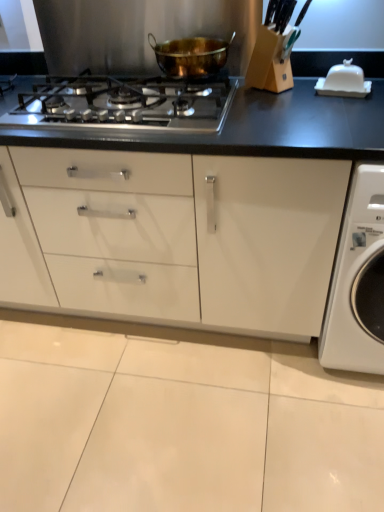
What do you see at coordinates (125, 104) in the screenshot? The height and width of the screenshot is (512, 384). I see `satin silver gas stove at center` at bounding box center [125, 104].

This screenshot has height=512, width=384. In order to click on white glossy washing machine at right in this screenshot , I will do `click(358, 281)`.

Is white glossy washing machine at right next to satin silver gas stove at center and touching it?

white glossy washing machine at right and satin silver gas stove at center are clearly separated.

Is white glossy washing machine at right inside or outside of satin silver gas stove at center?

white glossy washing machine at right is spatially situated outside satin silver gas stove at center.

Considering the positions of objects white glossy washing machine at right and satin silver gas stove at center in the image provided, who is in front, white glossy washing machine at right or satin silver gas stove at center?

white glossy washing machine at right is in front.

Does white glossy washing machine at right have a smaller size compared to satin silver gas stove at center?

Actually, white glossy washing machine at right might be larger than satin silver gas stove at center.

Can you confirm if gold metallic pot at center is shorter than white glossy washing machine at right?

Yes, gold metallic pot at center is shorter than white glossy washing machine at right.

Would you say gold metallic pot at center is inside or outside white glossy washing machine at right?

gold metallic pot at center lies outside white glossy washing machine at right.

Is gold metallic pot at center looking in the opposite direction of white glossy washing machine at right?

gold metallic pot at center does not have its back to white glossy washing machine at right.

From the image's perspective, which object appears higher, white glossy washing machine at right or gold metallic pot at center?

gold metallic pot at center.

I want to click on kitchen appliance above the white glossy washing machine at right (from a real-world perspective), so click(191, 56).

Is white glossy washing machine at right oriented away from gold metallic pot at center?

No, white glossy washing machine at right is not facing away from gold metallic pot at center.

From a real-world perspective, is white glossy washing machine at right on top of gold metallic pot at center?

No, from a real-world perspective, white glossy washing machine at right is not over gold metallic pot at center

Are satin silver gas stove at center and gold metallic pot at center beside each other?

satin silver gas stove at center and gold metallic pot at center are clearly separated.

Considering the sizes of satin silver gas stove at center and gold metallic pot at center in the image, is satin silver gas stove at center wider or thinner than gold metallic pot at center?

In the image, satin silver gas stove at center appears to be wider than gold metallic pot at center.

You are a GUI agent. You are given a task and a screenshot of the screen. Output one action in this format:
    pyautogui.click(x=<x>, y=<y>)
    Task: Click on the kitchen appliance that appears on the right of satin silver gas stove at center
    The width and height of the screenshot is (384, 512).
    Given the screenshot: What is the action you would take?
    pyautogui.click(x=191, y=56)

Which of these two, satin silver gas stove at center or gold metallic pot at center, stands taller?

gold metallic pot at center.

Which is in front, gold metallic pot at center or satin silver gas stove at center?

satin silver gas stove at center.

Between gold metallic pot at center and satin silver gas stove at center, which one has more height?

Standing taller between the two is gold metallic pot at center.

Looking at their sizes, would you say gold metallic pot at center is wider or thinner than satin silver gas stove at center?

Clearly, gold metallic pot at center has less width compared to satin silver gas stove at center.

From the image's perspective, which is above, satin silver gas stove at center or white glossy washing machine at right?

satin silver gas stove at center appears higher in the image.

Is satin silver gas stove at center wider or thinner than white glossy washing machine at right?

Clearly, satin silver gas stove at center has less width compared to white glossy washing machine at right.

The height and width of the screenshot is (512, 384). In order to click on gas stove on the left of white glossy washing machine at right in this screenshot , I will do `click(125, 104)`.

Identify the location of washing machine on the right side of gold metallic pot at center. (358, 281).

Estimate the real-world distances between objects in this image. Which object is further from white glossy washing machine at right, satin silver gas stove at center or gold metallic pot at center?

gold metallic pot at center lies further to white glossy washing machine at right than the other object.

Estimate the real-world distances between objects in this image. Which object is further from gold metallic pot at center, satin silver gas stove at center or white glossy washing machine at right?

white glossy washing machine at right.

Based on their spatial positions, is gold metallic pot at center or satin silver gas stove at center further from white glossy washing machine at right?

gold metallic pot at center lies further to white glossy washing machine at right than the other object.

Based on their spatial positions, is white glossy washing machine at right or gold metallic pot at center closer to satin silver gas stove at center?

Based on the image, gold metallic pot at center appears to be nearer to satin silver gas stove at center.

Considering their positions, is gold metallic pot at center positioned closer to satin silver gas stove at center than white glossy washing machine at right?

gold metallic pot at center is closer to satin silver gas stove at center.

Which object lies nearer to the anchor point gold metallic pot at center, white glossy washing machine at right or satin silver gas stove at center?

Among the two, satin silver gas stove at center is located nearer to gold metallic pot at center.

Image resolution: width=384 pixels, height=512 pixels. What are the coordinates of `kitchen appliance between satin silver gas stove at center and white glossy washing machine at right from left to right` in the screenshot? It's located at (191, 56).